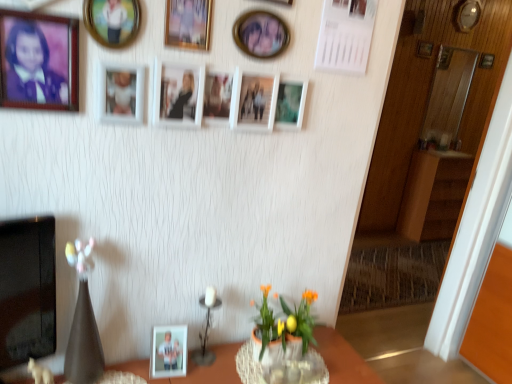
Question: Is wooden picture frame at upper right, which is the 12th picture frame from bottom to top, thinner than white matte picture frame at center, placed as the sixth picture frame when sorted from back to front?

Choices:
 (A) yes
 (B) no

Answer: (A)

Question: Does wooden picture frame at upper right, which ranks as the first picture frame in right-to-left order, appear on the right side of white matte picture frame at center, placed as the sixth picture frame when sorted from back to front?

Choices:
 (A) no
 (B) yes

Answer: (B)

Question: Does wooden picture frame at upper right, which is the 12th picture frame from bottom to top, appear on the left side of white matte picture frame at center, the 8th picture frame when ordered from front to back?

Choices:
 (A) no
 (B) yes

Answer: (A)

Question: From a real-world perspective, is wooden picture frame at upper right, which ranks as the first picture frame in right-to-left order, positioned over white matte picture frame at center, which is the 8th picture frame from left to right, based on gravity?

Choices:
 (A) yes
 (B) no

Answer: (A)

Question: Is wooden picture frame at upper right, which ranks as the thirteenth picture frame in left-to-right order, positioned before white matte picture frame at center, the 8th picture frame when ordered from front to back?

Choices:
 (A) yes
 (B) no

Answer: (B)

Question: From the image's perspective, relative to wooden picture frame at upper right, positioned as the 11th picture frame in left-to-right order, is metallic silver picture frame at upper center, placed as the 5th picture frame when sorted from bottom to top, above or below?

Choices:
 (A) below
 (B) above

Answer: (A)

Question: Looking at their shapes, would you say metallic silver picture frame at upper center, arranged as the ninth picture frame when viewed from the top, is wider or thinner than wooden picture frame at upper right, the 11th picture frame in the front-to-back sequence?

Choices:
 (A) thin
 (B) wide

Answer: (A)

Question: Considering the positions of metallic silver picture frame at upper center, which ranks as the 4th picture frame in right-to-left order, and wooden picture frame at upper right, which is counted as the eleventh picture frame, starting from the bottom, in the image, is metallic silver picture frame at upper center, which ranks as the 4th picture frame in right-to-left order, bigger or smaller than wooden picture frame at upper right, which is counted as the eleventh picture frame, starting from the bottom,?

Choices:
 (A) small
 (B) big

Answer: (A)

Question: Considering the positions of point (301, 99) and point (429, 54), is point (301, 99) closer or farther from the camera than point (429, 54)?

Choices:
 (A) farther
 (B) closer

Answer: (B)

Question: From a real-world perspective, is clear glass vase at lower center physically located above or below matte wooden picture frame at upper left, acting as the 13th picture frame starting from the right?

Choices:
 (A) above
 (B) below

Answer: (B)

Question: Is clear glass vase at lower center wider or thinner than matte wooden picture frame at upper left, which ranks as the 7th picture frame in top-to-bottom order?

Choices:
 (A) thin
 (B) wide

Answer: (B)

Question: In terms of height, does clear glass vase at lower center look taller or shorter compared to matte wooden picture frame at upper left, which is the thirteenth picture frame from back to front?

Choices:
 (A) tall
 (B) short

Answer: (B)

Question: Based on their sizes in the image, would you say clear glass vase at lower center is bigger or smaller than matte wooden picture frame at upper left, acting as the 7th picture frame starting from the bottom?

Choices:
 (A) big
 (B) small

Answer: (B)

Question: Does point (174, 329) appear closer or farther from the camera than point (262, 114)?

Choices:
 (A) closer
 (B) farther

Answer: (B)

Question: Is matte white photo frame at lower center, which appears as the first picture frame when ordered from the bottom, bigger or smaller than white matte picture frame at center, which is the sixth picture frame from right to left?

Choices:
 (A) small
 (B) big

Answer: (B)